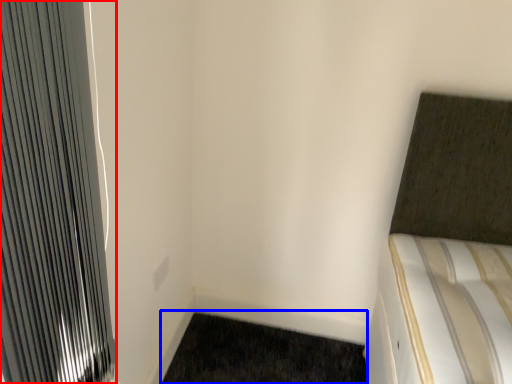
Question: Which of the following is the farthest to the observer, radiator (highlighted by a red box) or doormat (highlighted by a blue box)?

Choices:
 (A) radiator
 (B) doormat

Answer: (B)